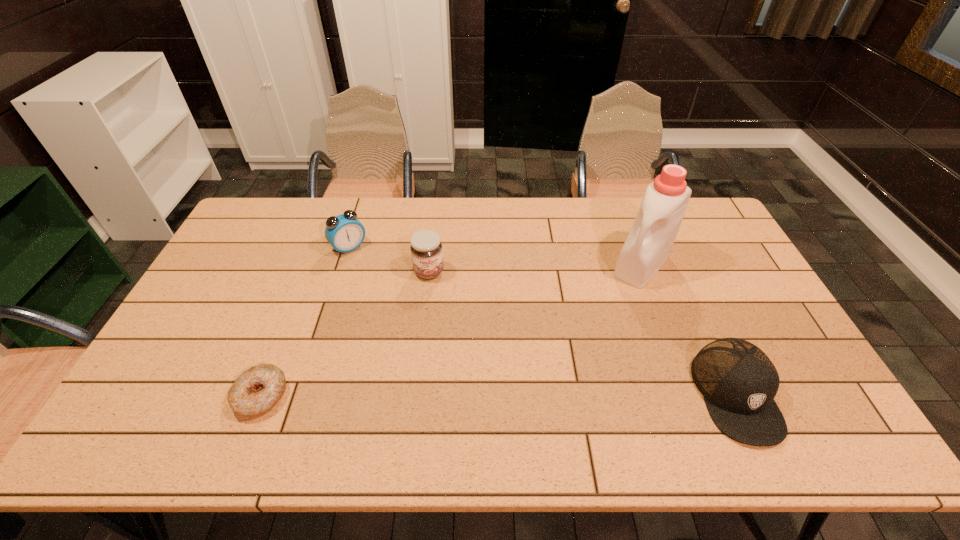
At what (x,y) coordinates should I click in order to perform the action: click on vacant space that satisfies the following two spatial constraints: 1. on the back side of the jam; 2. on the left side of the shortest object. Please return your answer as a coordinate pair (x, y). Looking at the image, I should click on (310, 272).